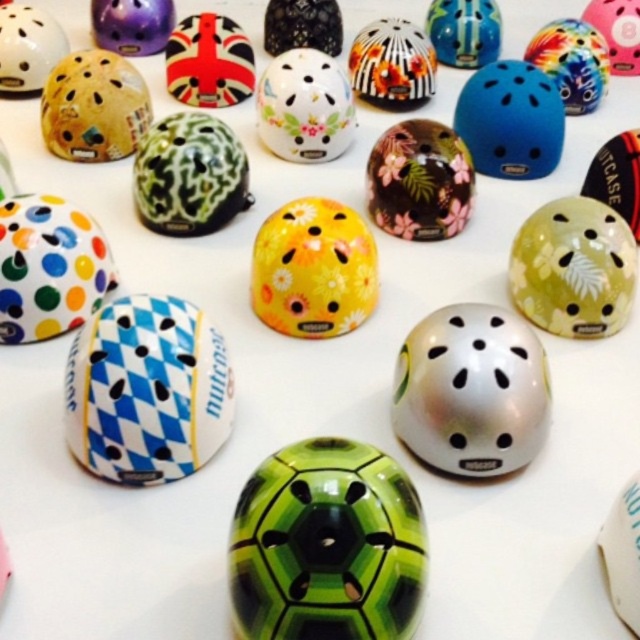
Question: Which of the following is the closest to the observer?

Choices:
 (A) (627, 48)
 (B) (24, 214)
 (C) (532, 92)
 (D) (28, 44)

Answer: (B)

Question: Does fluorescent green matte helmet at center appear under pink matte helmet at upper right?

Choices:
 (A) yes
 (B) no

Answer: (A)

Question: Which point is farther to the camera?

Choices:
 (A) (320, 259)
 (B) (310, 147)
 (C) (611, 61)

Answer: (C)

Question: Can you confirm if metallic silver helmet at center is wider than glossy blue helmet at upper center?

Choices:
 (A) no
 (B) yes

Answer: (A)

Question: Which is farther from the white glossy helmet at center?

Choices:
 (A) floral glossy helmet at center
 (B) polka dot matte helmet at lower left
 (C) pink matte helmet at upper right
 (D) glossy blue helmet at upper center

Answer: (C)

Question: Is fluorescent green matte helmet at center wider than matte white helmet at upper left?

Choices:
 (A) no
 (B) yes

Answer: (B)